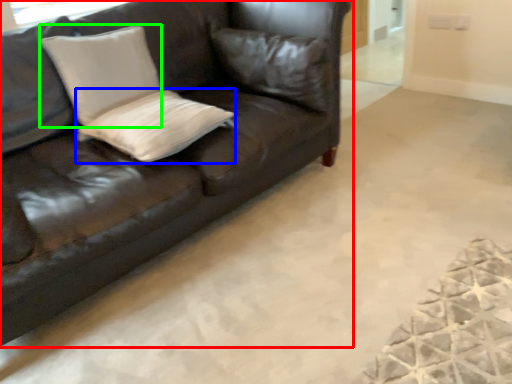
Question: Which object is positioned farthest from studio couch (highlighted by a red box)? Select from pillow (highlighted by a blue box) and pillow (highlighted by a green box).

Choices:
 (A) pillow
 (B) pillow

Answer: (B)